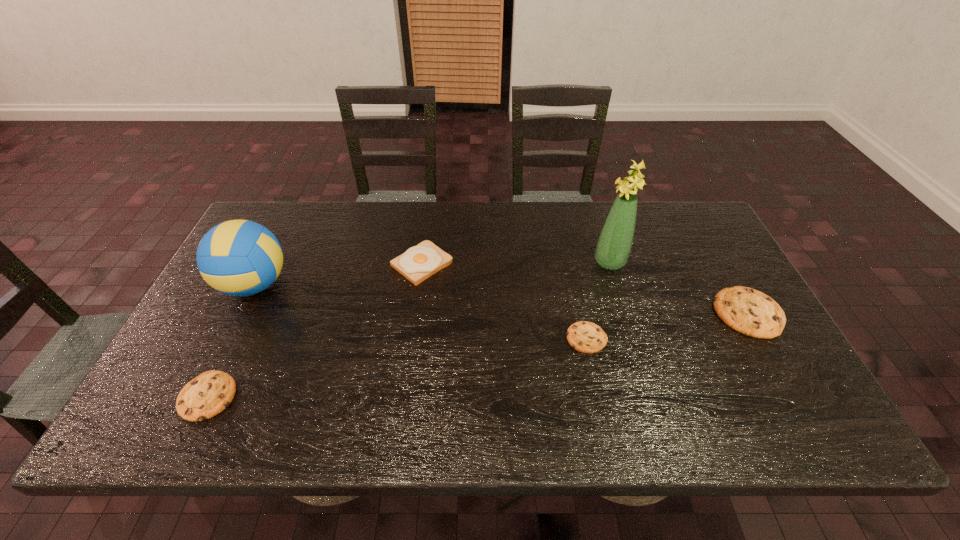
This screenshot has height=540, width=960. I want to click on free spot that satisfies the following two spatial constraints: 1. on the front side of the volleyball; 2. on the left side of the third shortest object, so click(240, 313).

Locate an element on the screen. The width and height of the screenshot is (960, 540). vacant space that satisfies the following two spatial constraints: 1. on the front side of the fifth shortest object; 2. on the right side of the shortest cookie is located at coordinates (228, 338).

You are a GUI agent. You are given a task and a screenshot of the screen. Output one action in this format:
    pyautogui.click(x=<x>, y=<y>)
    Task: Click on the vacant region that satisfies the following two spatial constraints: 1. on the front-facing side of the tallest object; 2. on the front side of the toast
    
    Given the screenshot: What is the action you would take?
    pyautogui.click(x=611, y=264)

Find the location of a particular element. Image resolution: width=960 pixels, height=540 pixels. free space that satisfies the following two spatial constraints: 1. on the back side of the second shortest object; 2. on the left side of the shortest cookie is located at coordinates (236, 338).

You are a GUI agent. You are given a task and a screenshot of the screen. Output one action in this format:
    pyautogui.click(x=<x>, y=<y>)
    Task: Click on the free location that satisfies the following two spatial constraints: 1. on the front-facing side of the second object from right to left; 2. on the front side of the third object from left to right
    
    Given the screenshot: What is the action you would take?
    pyautogui.click(x=611, y=264)